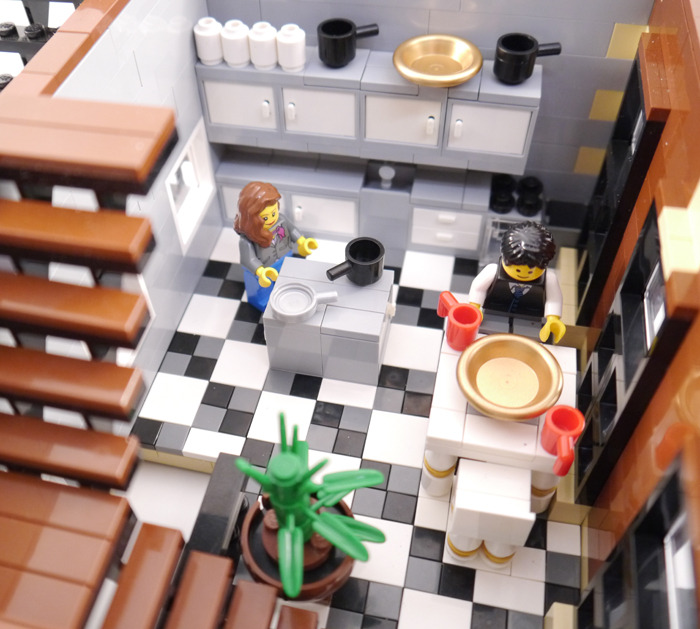
At what (x,y) coordinates should I click in order to perform the action: click on tiny plastic house plant pot. Please return your answer as a coordinate pair (x, y). Looking at the image, I should click on (337, 579).